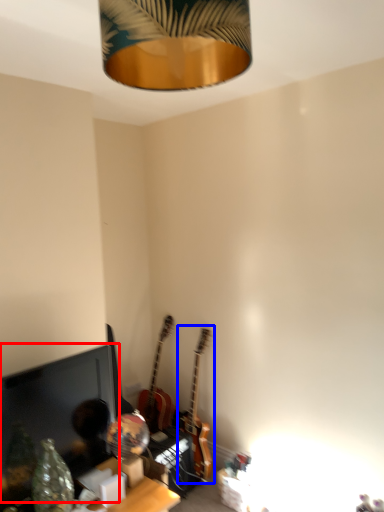
Question: Which object is further to the camera taking this photo, computer monitor (highlighted by a red box) or guitar (highlighted by a blue box)?

Choices:
 (A) computer monitor
 (B) guitar

Answer: (B)